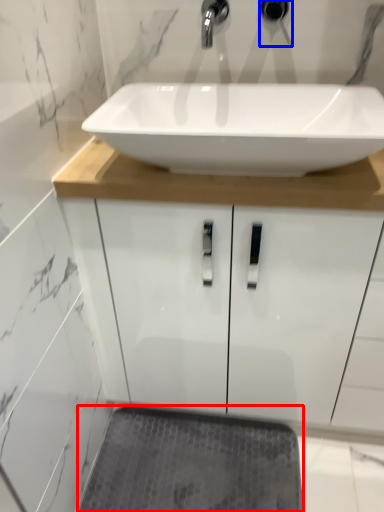
Question: Which point is further to the camera, bath mat (highlighted by a red box) or plumbing fixture (highlighted by a blue box)?

Choices:
 (A) bath mat
 (B) plumbing fixture

Answer: (A)